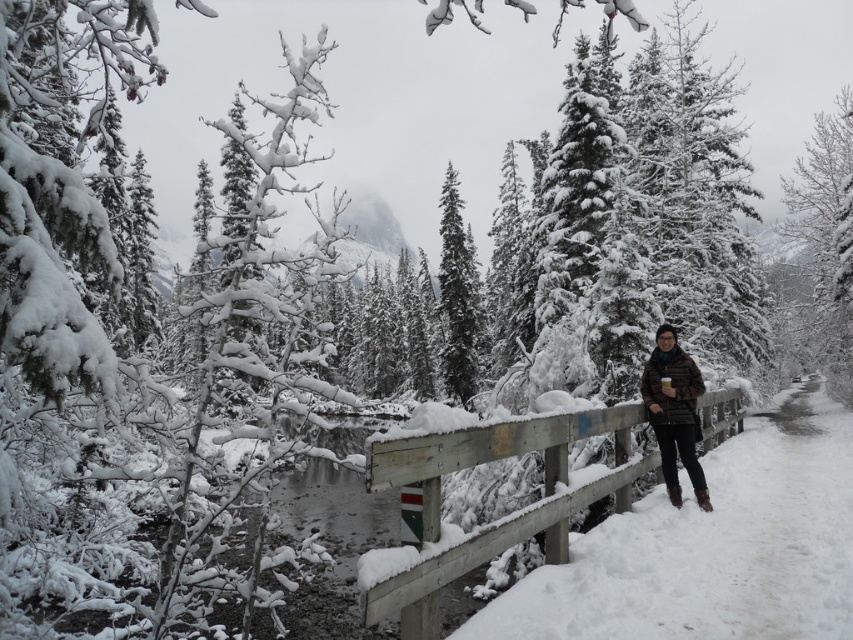
Does point (807, 209) lie in front of point (448, 294)?

Yes, point (807, 209) is in front of point (448, 294).

Who is higher up, snow-covered evergreen at right or snow-covered evergreen tree at center?

snow-covered evergreen at right is above.

Which is behind, point (845, 339) or point (456, 209)?

The point (456, 209) is more distant.

Locate an element on the screen. snow-covered evergreen at right is located at coordinates (827, 236).

Can you confirm if wooden fence at center is wider than brown fuzzy jacket at lower right?

Yes, wooden fence at center is wider than brown fuzzy jacket at lower right.

Who is positioned more to the right, wooden fence at center or brown fuzzy jacket at lower right?

wooden fence at center

The image size is (853, 640). In order to click on wooden fence at center in this screenshot , I will do `click(498, 518)`.

What are the coordinates of `wooden fence at center` in the screenshot? It's located at (498, 518).

Is wooden fence at center positioned at the back of snow-covered evergreen at right?

No, it is not.

Does point (552, 504) lie in front of point (817, 115)?

Yes, point (552, 504) is closer to viewer.

From the picture: Who is more forward, (555, 532) or (815, 132)?

Positioned in front is point (555, 532).

Where is `wooden fence at center`? wooden fence at center is located at coordinates (498, 518).